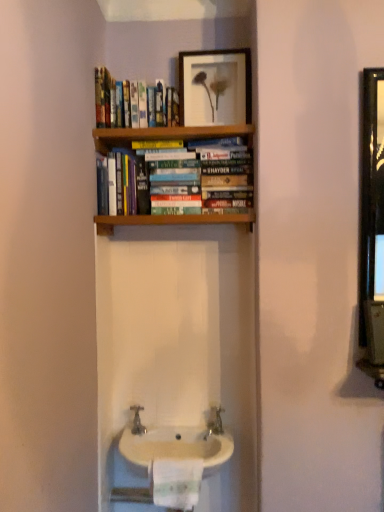
What do you see at coordinates (176, 483) in the screenshot? This screenshot has height=512, width=384. I see `white paper towel at lower center` at bounding box center [176, 483].

What do you see at coordinates (137, 421) in the screenshot? The height and width of the screenshot is (512, 384). I see `silver metallic tap at center` at bounding box center [137, 421].

Locate an element on the screen. hardcover book at center is located at coordinates (175, 182).

This screenshot has height=512, width=384. Describe the element at coordinates (175, 182) in the screenshot. I see `hardcover book at center` at that location.

Describe the element at coordinates (178, 444) in the screenshot. I see `white glossy sink at lower center` at that location.

Image resolution: width=384 pixels, height=512 pixels. I want to click on hardcover books at upper center, so click(118, 101).

The width and height of the screenshot is (384, 512). I want to click on white paper towel at lower center, so click(x=176, y=483).

From the image's perspective, would you say hardcover books at upper center is positioned over white glossy sink at lower center?

Correct, hardcover books at upper center appears higher than white glossy sink at lower center in the image.

Find the location of a particular element. This screenshot has width=384, height=512. sink below the hardcover books at upper center (from a real-world perspective) is located at coordinates (178, 444).

Between hardcover books at upper center and white glossy sink at lower center, which one has smaller size?

hardcover books at upper center.

Does white paper towel at lower center appear on the left side of silver metallic tap at center?

In fact, white paper towel at lower center is to the right of silver metallic tap at center.

Is white paper towel at lower center next to silver metallic tap at center and touching it?

No, white paper towel at lower center is not beside silver metallic tap at center.

Can silver metallic tap at center be found inside white paper towel at lower center?

No, silver metallic tap at center is not surrounded by white paper towel at lower center.

Considering the sizes of objects silver metallic tap at center and hardcover book at center in the image provided, who is taller, silver metallic tap at center or hardcover book at center?

hardcover book at center is taller.

Is silver metallic tap at center looking in the opposite direction of hardcover book at center?

silver metallic tap at center does not have its back to hardcover book at center.

From the image's perspective, is silver metallic tap at center located above or below hardcover book at center?

Based on their image positions, silver metallic tap at center is located beneath hardcover book at center.

Which object is positioned more to the right, white paper towel at lower center or hardcover book at center?

From the viewer's perspective, white paper towel at lower center appears more on the right side.

In the scene shown: Is white paper towel at lower center aimed at hardcover book at center?

No, white paper towel at lower center is not facing towards hardcover book at center.

From a real-world perspective, is white paper towel at lower center located higher than hardcover book at center?

Actually, white paper towel at lower center is physically below hardcover book at center in the real world.

Is point (177, 469) positioned in front of point (164, 167)?

Yes.

Identify the location of picture frame above the silver metallic tap at center (from a real-world perspective). (215, 87).

Is matte wooden picture frame at upper center shorter than silver metallic tap at center?

No.

Is matte wooden picture frame at upper center next to silver metallic tap at center?

There is a gap between matte wooden picture frame at upper center and silver metallic tap at center.

Does hardcover books at upper center turn towards white paper towel at lower center?

No, hardcover books at upper center does not turn towards white paper towel at lower center.

From the image's perspective, is hardcover books at upper center beneath white paper towel at lower center?

No, from the image's perspective, hardcover books at upper center is not beneath white paper towel at lower center.

Is point (173, 88) closer or farther from the camera than point (179, 507)?

Clearly, point (173, 88) is more distant from the camera than point (179, 507).

Image resolution: width=384 pixels, height=512 pixels. In order to click on toilet paper on the right of hardcover books at upper center in this screenshot , I will do pyautogui.click(x=176, y=483).

From the picture: Is hardcover book at center far from matte wooden picture frame at upper center?

Actually, hardcover book at center and matte wooden picture frame at upper center are a little close together.

From the image's perspective, between hardcover book at center and matte wooden picture frame at upper center, which one is located above?

matte wooden picture frame at upper center.

Considering the sizes of hardcover book at center and matte wooden picture frame at upper center in the image, is hardcover book at center taller or shorter than matte wooden picture frame at upper center?

hardcover book at center is taller than matte wooden picture frame at upper center.

Considering the sizes of objects hardcover book at center and matte wooden picture frame at upper center in the image provided, who is thinner, hardcover book at center or matte wooden picture frame at upper center?

With smaller width is matte wooden picture frame at upper center.

Where is `book located above the white glossy sink at lower center (from a real-world perspective)`? book located above the white glossy sink at lower center (from a real-world perspective) is located at coordinates (118, 101).

The width and height of the screenshot is (384, 512). I want to click on toilet paper below the silver metallic tap at center (from the image's perspective), so click(176, 483).

Considering their positions, is hardcover books at upper center positioned further to silver metallic tap at center than white paper towel at lower center?

hardcover books at upper center is further to silver metallic tap at center.

When comparing their distances from matte wooden picture frame at upper center, does white glossy sink at lower center or silver metallic tap at center seem closer?

Based on the image, white glossy sink at lower center appears to be nearer to matte wooden picture frame at upper center.

When comparing their distances from white paper towel at lower center, does hardcover book at center or silver metallic tap at center seem further?

hardcover book at center.

From the image, which object appears to be nearer to white glossy sink at lower center, matte wooden picture frame at upper center or hardcover books at upper center?

Among the two, hardcover books at upper center is located nearer to white glossy sink at lower center.

Which object lies nearer to the anchor point white paper towel at lower center, matte wooden picture frame at upper center or white glossy sink at lower center?

white glossy sink at lower center is closer to white paper towel at lower center.

From the image, which object appears to be farther from silver metallic tap at center, white paper towel at lower center or hardcover book at center?

hardcover book at center.

When comparing their distances from silver metallic tap at center, does matte wooden picture frame at upper center or white glossy sink at lower center seem closer?

The object closer to silver metallic tap at center is white glossy sink at lower center.

Looking at the image, which one is located closer to matte wooden picture frame at upper center, white glossy sink at lower center or hardcover book at center?

hardcover book at center is closer to matte wooden picture frame at upper center.

The width and height of the screenshot is (384, 512). I want to click on book between matte wooden picture frame at upper center and white paper towel at lower center vertically, so click(118, 101).

This screenshot has height=512, width=384. What are the coordinates of `tap between matte wooden picture frame at upper center and white glossy sink at lower center in the vertical direction` in the screenshot? It's located at (137, 421).

Identify the location of book between matte wooden picture frame at upper center and hardcover book at center in the up-down direction. (118, 101).

This screenshot has height=512, width=384. Identify the location of tap that lies between hardcover book at center and white paper towel at lower center from top to bottom. (137, 421).